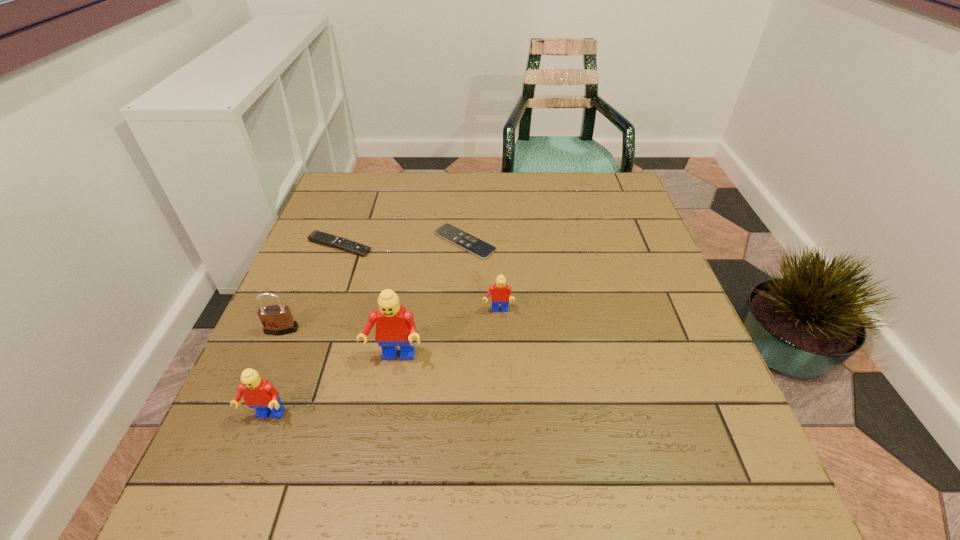
Locate an element on the screen. The width and height of the screenshot is (960, 540). vacant point located between the second shortest object and the nearest Lego is located at coordinates (303, 331).

This screenshot has width=960, height=540. Identify the location of free space between the left remote control and the shortest object. (402, 244).

At what (x,y) coordinates should I click in order to perform the action: click on unoccupied position between the left remote control and the shortest Lego. Please return your answer as a coordinate pair (x, y). Looking at the image, I should click on (419, 279).

At what (x,y) coordinates should I click in order to perform the action: click on free space between the taller remote control and the third nearest object. Please return your answer as a coordinate pair (x, y). The height and width of the screenshot is (540, 960). Looking at the image, I should click on (311, 288).

Where is `free space between the farthest Lego and the taller remote control`? The height and width of the screenshot is (540, 960). free space between the farthest Lego and the taller remote control is located at coordinates (419, 279).

What are the coordinates of `the fifth closest object to the second shortest Lego` in the screenshot? It's located at pyautogui.click(x=469, y=243).

Locate which object is the fourth closest to the fourth nearest object. Please provide its 2D coordinates. Your answer should be formatted as a tuple, i.e. [(x, y)], where the tuple contains the x and y coordinates of a point satisfying the conditions above.

[(276, 319)]

I want to click on the closest Lego relative to the nearest Lego, so click(x=395, y=326).

At what (x,y) coordinates should I click in order to perform the action: click on the closest Lego to the third farthest object. Please return your answer as a coordinate pair (x, y). Looking at the image, I should click on (395, 326).